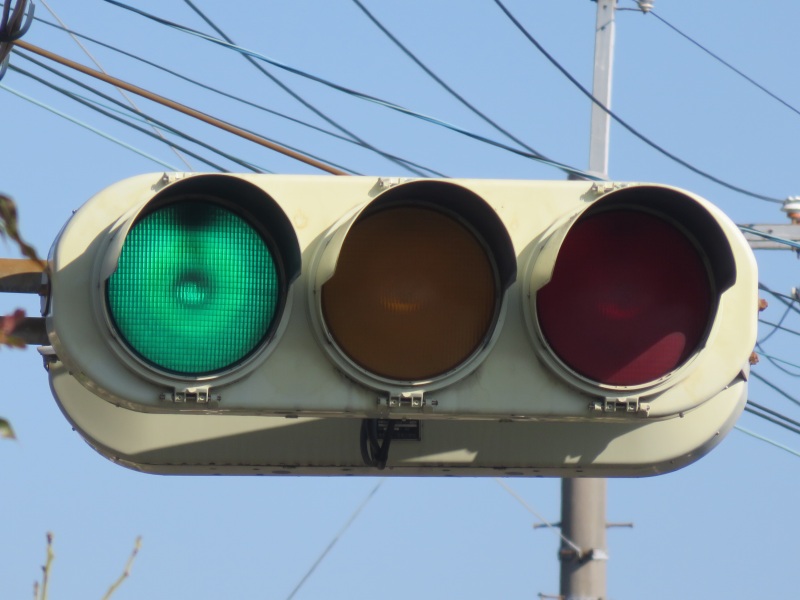
Locate an element on the screen. The height and width of the screenshot is (600, 800). lit up light is located at coordinates pos(218,288).